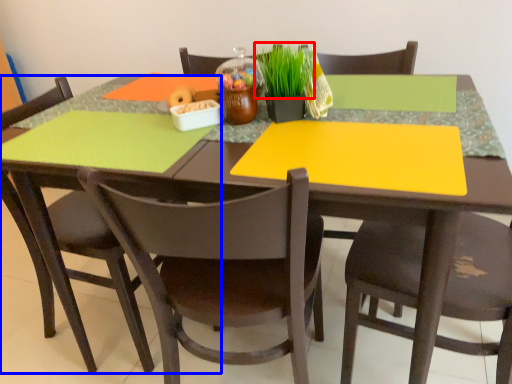
Question: Among these objects, which one is farthest to the camera, plant (highlighted by a red box) or chair (highlighted by a blue box)?

Choices:
 (A) plant
 (B) chair

Answer: (B)